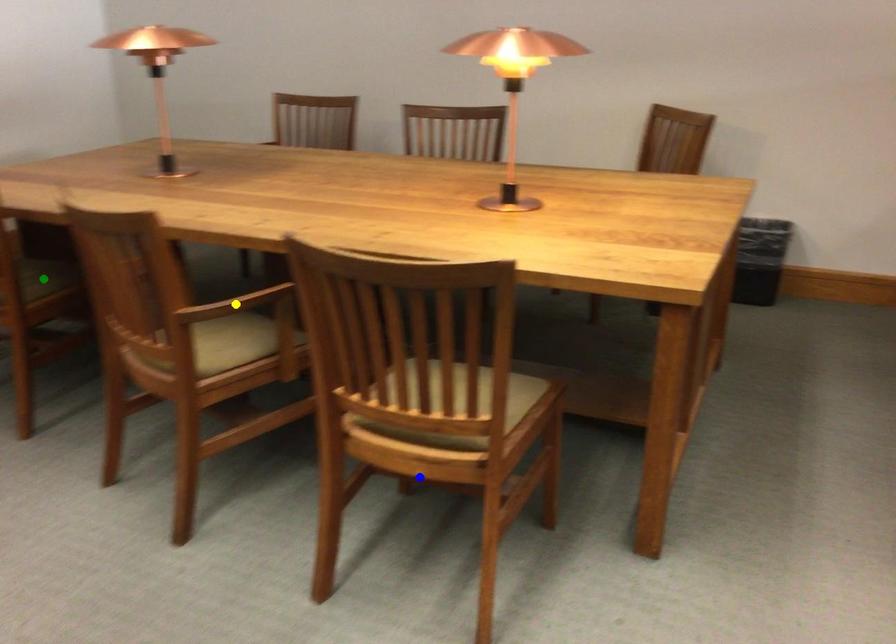
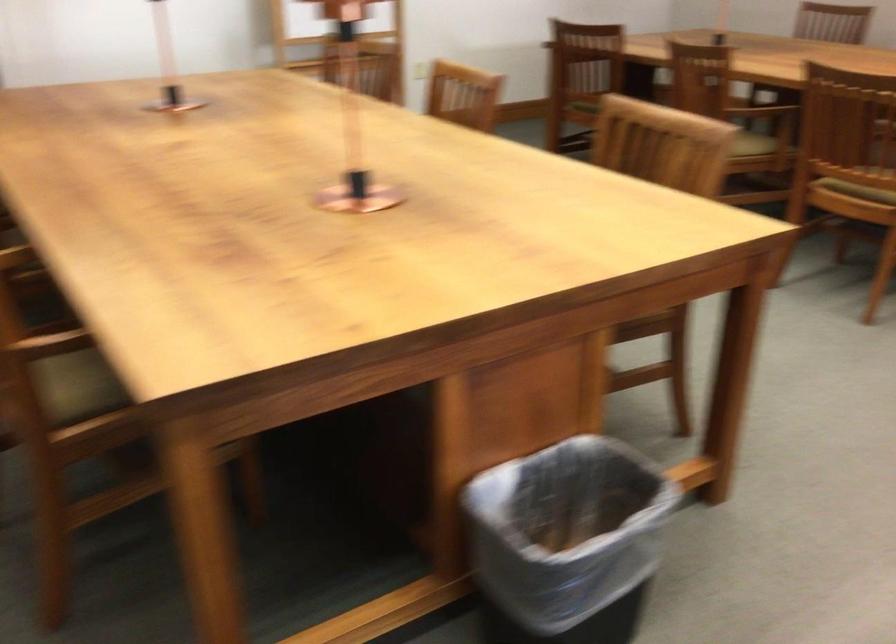
I am providing you with two images of the same scene from different viewpoints. Three points are marked in image1. Which point corresponds to a part or object that is occluded in image2?In image1, three points are marked. Which of them correspond to a part or object that is occluded in image2?Among the three points shown in image1, which one corresponds to a part or object that is no longer visible due to occlusion in image2?

Invisible in image2: green point, yellow point.